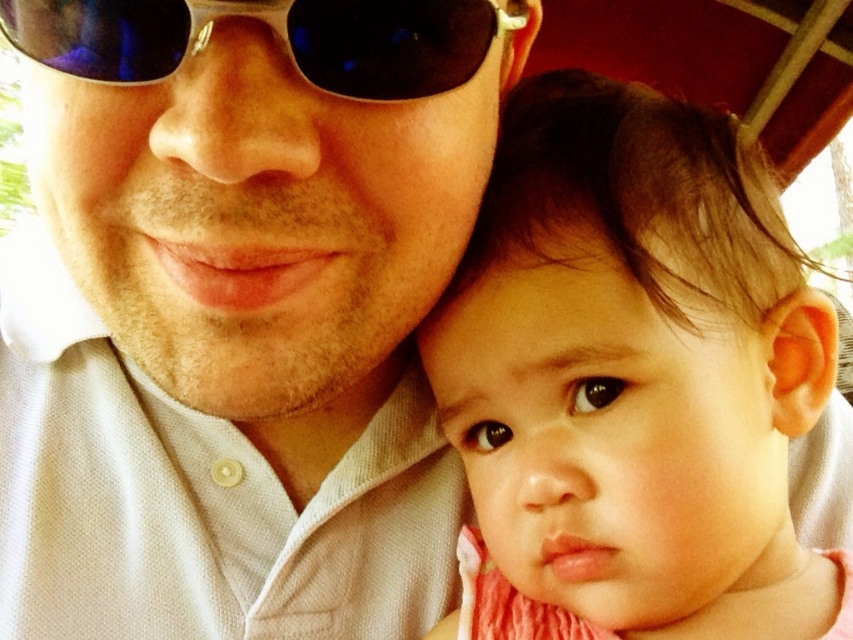
Question: Can you confirm if matte white shirt at center is positioned below sunglasses at upper center?

Choices:
 (A) no
 (B) yes

Answer: (B)

Question: Is matte white shirt at center above sunglasses at upper center?

Choices:
 (A) yes
 (B) no

Answer: (B)

Question: Which point is farther from the camera taking this photo?

Choices:
 (A) (689, 218)
 (B) (57, 12)
 (C) (392, 612)

Answer: (C)

Question: Among these objects, which one is farthest from the camera?

Choices:
 (A) sunglasses at upper center
 (B) smooth pink fabric at center

Answer: (B)

Question: Does matte white shirt at center have a lesser width compared to smooth pink fabric at center?

Choices:
 (A) no
 (B) yes

Answer: (A)

Question: Among these points, which one is nearest to the camera?

Choices:
 (A) (122, 28)
 (B) (569, 364)

Answer: (A)